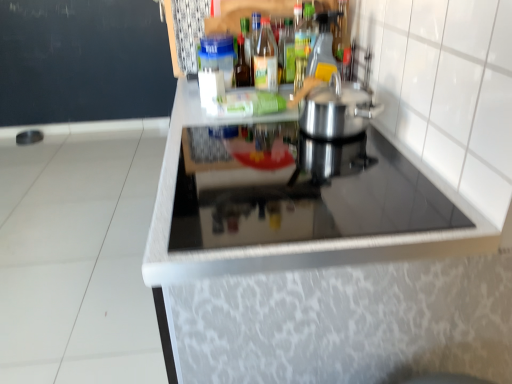
The width and height of the screenshot is (512, 384). Describe the element at coordinates (242, 65) in the screenshot. I see `translucent glass bottle at center, which is counted as the 1th bottle, starting from the left` at that location.

What is the approximate height of satin silver pot at center?

satin silver pot at center is 6.23 inches in height.

The image size is (512, 384). Identify the location of translucent glass bottle at upper center, the 2th bottle in the right-to-left sequence. (287, 53).

Can you confirm if translucent glass bottle at upper center, which ranks as the fourth bottle in left-to-right order, is smaller than clear glass bottle at upper center, placed as the 3th bottle when sorted from right to left?

Yes, translucent glass bottle at upper center, which ranks as the fourth bottle in left-to-right order, is smaller than clear glass bottle at upper center, placed as the 3th bottle when sorted from right to left.

From a real-world perspective, which is physically below, translucent glass bottle at upper center, which ranks as the fourth bottle in left-to-right order, or clear glass bottle at upper center, which ranks as the third bottle in left-to-right order?

translucent glass bottle at upper center, which ranks as the fourth bottle in left-to-right order.

From the image's perspective, which is below, translucent glass bottle at upper center, which ranks as the fourth bottle in left-to-right order, or clear glass bottle at upper center, which ranks as the third bottle in left-to-right order?

clear glass bottle at upper center, which ranks as the third bottle in left-to-right order, is shown below in the image.

Is translucent glass bottle at upper center, the 2th bottle in the right-to-left sequence, touching clear glass bottle at upper center, placed as the 3th bottle when sorted from right to left?

Yes, translucent glass bottle at upper center, the 2th bottle in the right-to-left sequence, is beside clear glass bottle at upper center, placed as the 3th bottle when sorted from right to left.

Considering the relative positions of translucent plastic bottle at upper center, the 4th bottle in the right-to-left sequence, and translucent glass bottle at center, which is counted as the 1th bottle, starting from the left, in the image provided, is translucent plastic bottle at upper center, the 4th bottle in the right-to-left sequence, to the left or to the right of translucent glass bottle at center, which is counted as the 1th bottle, starting from the left,?

translucent plastic bottle at upper center, the 4th bottle in the right-to-left sequence, is to the right of translucent glass bottle at center, which is counted as the 1th bottle, starting from the left.

Which is correct: translucent plastic bottle at upper center, the 4th bottle in the right-to-left sequence, is inside translucent glass bottle at center, acting as the 5th bottle starting from the right, or outside of it?

translucent plastic bottle at upper center, the 4th bottle in the right-to-left sequence, exists outside the volume of translucent glass bottle at center, acting as the 5th bottle starting from the right.

How much distance is there between translucent plastic bottle at upper center, which appears as the 2th bottle when viewed from the left, and translucent glass bottle at center, acting as the 5th bottle starting from the right?

They are 1.62 inches apart.

Can you see translucent plastic bottle at upper center, which appears as the 2th bottle when viewed from the left, touching translucent glass bottle at center, which is counted as the 1th bottle, starting from the left?

Indeed, translucent plastic bottle at upper center, which appears as the 2th bottle when viewed from the left, and translucent glass bottle at center, which is counted as the 1th bottle, starting from the left, are beside each other and touching.

Between satin silver pot at center and clear glass bottle at upper center, which ranks as the third bottle in left-to-right order, which one appears on the left side from the viewer's perspective?

Positioned to the left is clear glass bottle at upper center, which ranks as the third bottle in left-to-right order.

From the picture: Measure the distance between satin silver pot at center and clear glass bottle at upper center, which ranks as the third bottle in left-to-right order.

satin silver pot at center is 36.11 centimeters from clear glass bottle at upper center, which ranks as the third bottle in left-to-right order.

Is satin silver pot at center facing towards clear glass bottle at upper center, which ranks as the third bottle in left-to-right order?

No, satin silver pot at center is not oriented towards clear glass bottle at upper center, which ranks as the third bottle in left-to-right order.

Looking at this image, would you say satin silver pot at center is inside or outside clear glass bottle at upper center, placed as the 3th bottle when sorted from right to left?

satin silver pot at center is not enclosed by clear glass bottle at upper center, placed as the 3th bottle when sorted from right to left.

Is translucent glass bottle at center, acting as the 5th bottle starting from the right, bigger or smaller than translucent plastic bottle at upper center, which appears as the 2th bottle when viewed from the left?

translucent glass bottle at center, acting as the 5th bottle starting from the right, is smaller than translucent plastic bottle at upper center, which appears as the 2th bottle when viewed from the left.

Does point (239, 44) appear closer or farther from the camera than point (260, 24)?

Clearly, point (239, 44) is more distant from the camera than point (260, 24).

Choose the correct answer: Is translucent glass bottle at center, which is counted as the 1th bottle, starting from the left, inside translucent plastic bottle at upper center, the 4th bottle in the right-to-left sequence, or outside it?

translucent glass bottle at center, which is counted as the 1th bottle, starting from the left, cannot be found inside translucent plastic bottle at upper center, the 4th bottle in the right-to-left sequence.

From the image's perspective, is translucent glass bottle at center, which is counted as the 1th bottle, starting from the left, on translucent plastic bottle at upper center, which appears as the 2th bottle when viewed from the left?

No, from the image's perspective, translucent glass bottle at center, which is counted as the 1th bottle, starting from the left, is not on top of translucent plastic bottle at upper center, which appears as the 2th bottle when viewed from the left.

Considering the relative positions of translucent glass bottle at upper center, the 2th bottle in the right-to-left sequence, and translucent glass bottle at center, which is counted as the 1th bottle, starting from the left, in the image provided, is translucent glass bottle at upper center, the 2th bottle in the right-to-left sequence, in front of translucent glass bottle at center, which is counted as the 1th bottle, starting from the left,?

No, translucent glass bottle at upper center, the 2th bottle in the right-to-left sequence, is further to the viewer.

Is translucent glass bottle at upper center, the 2th bottle in the right-to-left sequence, taller or shorter than translucent glass bottle at center, acting as the 5th bottle starting from the right?

Clearly, translucent glass bottle at upper center, the 2th bottle in the right-to-left sequence, is shorter compared to translucent glass bottle at center, acting as the 5th bottle starting from the right.

Considering the relative sizes of translucent glass bottle at upper center, the 2th bottle in the right-to-left sequence, and translucent glass bottle at center, acting as the 5th bottle starting from the right, in the image provided, is translucent glass bottle at upper center, the 2th bottle in the right-to-left sequence, bigger than translucent glass bottle at center, acting as the 5th bottle starting from the right,?

Incorrect, translucent glass bottle at upper center, the 2th bottle in the right-to-left sequence, is not larger than translucent glass bottle at center, acting as the 5th bottle starting from the right.

Between translucent glass bottle at upper center, the 2th bottle in the right-to-left sequence, and translucent glass bottle at center, which is counted as the 1th bottle, starting from the left, which one has larger width?

Wider between the two is translucent glass bottle at upper center, the 2th bottle in the right-to-left sequence.

Choose the correct answer: Is black glass cooktop at center inside translucent plastic bottle at upper center, the 4th bottle in the right-to-left sequence, or outside it?

black glass cooktop at center cannot be found inside translucent plastic bottle at upper center, the 4th bottle in the right-to-left sequence.

From a real-world perspective, is black glass cooktop at center over translucent plastic bottle at upper center, the 4th bottle in the right-to-left sequence?

No, from a real-world perspective, black glass cooktop at center is not on top of translucent plastic bottle at upper center, the 4th bottle in the right-to-left sequence.

Between black glass cooktop at center and translucent plastic bottle at upper center, the 4th bottle in the right-to-left sequence, which one is positioned in front?

black glass cooktop at center is more forward.

Can you see black glass cooktop at center touching translucent plastic bottle at upper center, which appears as the 2th bottle when viewed from the left?

No, black glass cooktop at center is not in contact with translucent plastic bottle at upper center, which appears as the 2th bottle when viewed from the left.

Is translucent glass bottle at upper center, the 2th bottle in the right-to-left sequence, facing towards black glass cooktop at center?

No, translucent glass bottle at upper center, the 2th bottle in the right-to-left sequence, does not turn towards black glass cooktop at center.

Can you confirm if translucent glass bottle at upper center, the 2th bottle in the right-to-left sequence, is wider than black glass cooktop at center?

In fact, translucent glass bottle at upper center, the 2th bottle in the right-to-left sequence, might be narrower than black glass cooktop at center.

Is translucent glass bottle at upper center, which ranks as the fourth bottle in left-to-right order, closer to the viewer compared to black glass cooktop at center?

No, the depth of translucent glass bottle at upper center, which ranks as the fourth bottle in left-to-right order, is greater than that of black glass cooktop at center.

From the image's perspective, starting from the translucent glass bottle at upper center, which ranks as the fourth bottle in left-to-right order, which bottle is the 2nd one below? Please provide its 2D coordinates.

[(266, 59)]

From the translucent glass bottle at center, acting as the 5th bottle starting from the right, count 1st bottles forward and point to it. Please provide its 2D coordinates.

[(253, 43)]

When comparing their distances from clear glass bottle at upper center, placed as the 3th bottle when sorted from right to left, does transparent glass bottle at upper center, which is the fifth bottle in left-to-right order, or black glass cooktop at center seem further?

Among the two, black glass cooktop at center is located further to clear glass bottle at upper center, placed as the 3th bottle when sorted from right to left.

Which object lies further to the anchor point clear glass bottle at upper center, which ranks as the third bottle in left-to-right order, black glass cooktop at center or satin silver pot at center?

black glass cooktop at center lies further to clear glass bottle at upper center, which ranks as the third bottle in left-to-right order, than the other object.

Looking at the image, which one is located closer to translucent glass bottle at upper center, which ranks as the fourth bottle in left-to-right order, translucent glass bottle at center, acting as the 5th bottle starting from the right, or clear glass bottle at upper center, which ranks as the third bottle in left-to-right order?

clear glass bottle at upper center, which ranks as the third bottle in left-to-right order.

Considering their positions, is transparent glass bottle at upper center, which is the fifth bottle in left-to-right order, positioned closer to translucent glass bottle at center, acting as the 5th bottle starting from the right, than translucent plastic bottle at upper center, which appears as the 2th bottle when viewed from the left?

translucent plastic bottle at upper center, which appears as the 2th bottle when viewed from the left, is closer to translucent glass bottle at center, acting as the 5th bottle starting from the right.

From the image, which object appears to be farther from translucent glass bottle at upper center, which ranks as the fourth bottle in left-to-right order, clear glass bottle at upper center, which ranks as the third bottle in left-to-right order, or translucent glass bottle at center, acting as the 5th bottle starting from the right?

Among the two, translucent glass bottle at center, acting as the 5th bottle starting from the right, is located further to translucent glass bottle at upper center, which ranks as the fourth bottle in left-to-right order.

Based on their spatial positions, is satin silver pot at center or translucent glass bottle at upper center, which ranks as the fourth bottle in left-to-right order, further from black glass cooktop at center?

Among the two, translucent glass bottle at upper center, which ranks as the fourth bottle in left-to-right order, is located further to black glass cooktop at center.

Looking at this image, based on their spatial positions, is clear glass bottle at upper center, placed as the 3th bottle when sorted from right to left, or translucent plastic bottle at upper center, which appears as the 2th bottle when viewed from the left, further from transparent glass bottle at upper center, which is the 1th bottle from right to left?

translucent plastic bottle at upper center, which appears as the 2th bottle when viewed from the left, is positioned further to the anchor transparent glass bottle at upper center, which is the 1th bottle from right to left.

Based on their spatial positions, is satin silver pot at center or translucent plastic bottle at upper center, which appears as the 2th bottle when viewed from the left, further from translucent glass bottle at center, which is counted as the 1th bottle, starting from the left?

satin silver pot at center is further to translucent glass bottle at center, which is counted as the 1th bottle, starting from the left.

Identify the location of kitchen appliance between black glass cooktop at center and translucent glass bottle at upper center, the 2th bottle in the right-to-left sequence, from front to back. The width and height of the screenshot is (512, 384). (337, 110).

What are the coordinates of `kitchen appliance located between black glass cooktop at center and clear glass bottle at upper center, placed as the 3th bottle when sorted from right to left, in the depth direction` in the screenshot? It's located at (337, 110).

Where is `kitchen appliance between black glass cooktop at center and transparent glass bottle at upper center, which is the fifth bottle in left-to-right order, along the z-axis`? kitchen appliance between black glass cooktop at center and transparent glass bottle at upper center, which is the fifth bottle in left-to-right order, along the z-axis is located at coordinates (337, 110).

At what (x,y) coordinates should I click in order to perform the action: click on bottle located between translucent plastic bottle at upper center, which appears as the 2th bottle when viewed from the left, and translucent glass bottle at upper center, the 2th bottle in the right-to-left sequence, in the left-right direction. Please return your answer as a coordinate pair (x, y). This screenshot has width=512, height=384. Looking at the image, I should click on (266, 59).